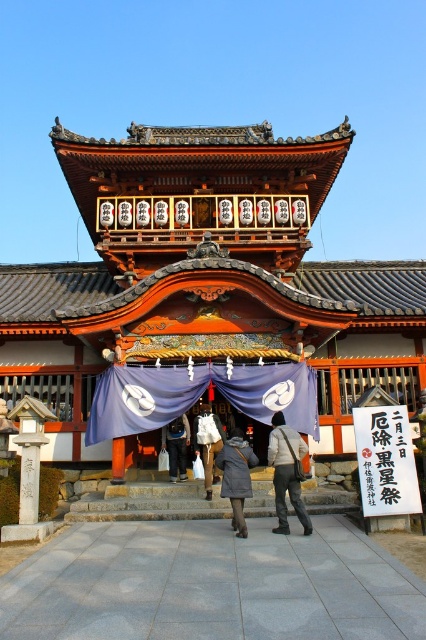
Which is behind, point (284, 420) or point (199, 436)?

The point (199, 436) is more distant.

Between light gray fabric jacket at center and white cotton bag at center, which one has more height?

light gray fabric jacket at center is taller.

Does point (279, 480) lie behind point (204, 420)?

No.

This screenshot has width=426, height=640. Identify the location of light gray fabric jacket at center. (287, 472).

Who is positioned more to the right, light gray fabric jacket at center or dark gray fabric bag at center?

light gray fabric jacket at center is more to the right.

Who is positioned more to the left, light gray fabric jacket at center or dark gray fabric bag at center?

From the viewer's perspective, dark gray fabric bag at center appears more on the left side.

Is point (287, 484) closer to camera compared to point (175, 428)?

Yes, it is in front of point (175, 428).

You are a GUI agent. You are given a task and a screenshot of the screen. Output one action in this format:
    pyautogui.click(x=<x>, y=<y>)
    Task: Click on the light gray fabric jacket at center
    
    Given the screenshot: What is the action you would take?
    pyautogui.click(x=287, y=472)

Is white paper sign at center taller than dark gray fabric bag at center?

Correct, white paper sign at center is much taller as dark gray fabric bag at center.

Does white paper sign at center have a greater width compared to dark gray fabric bag at center?

Yes, white paper sign at center is wider than dark gray fabric bag at center.

Find the location of a particular element. The height and width of the screenshot is (640, 426). white paper sign at center is located at coordinates [385, 460].